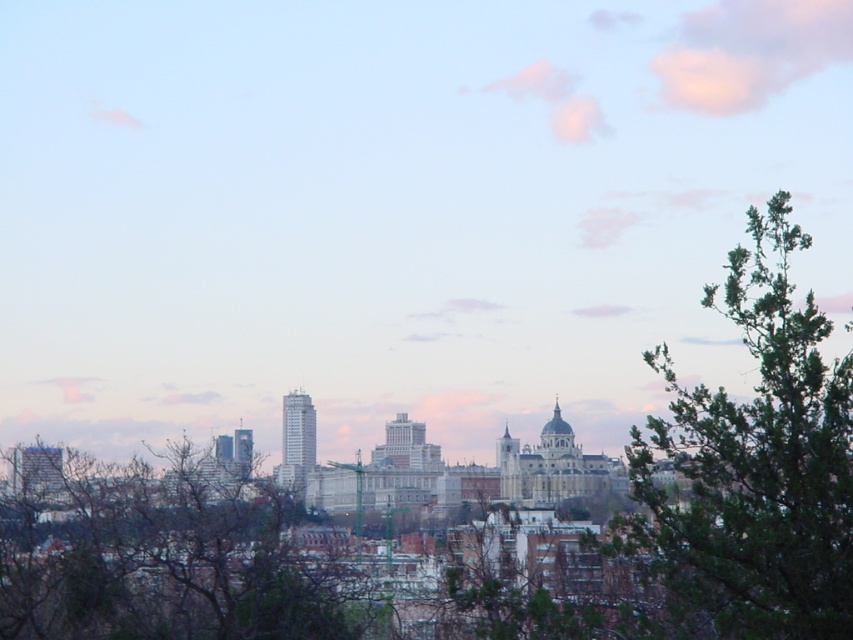
Which is below, green leafy tree at right or bare branches at center?

bare branches at center

Find the location of `green leafy tree at right`. green leafy tree at right is located at coordinates (752, 467).